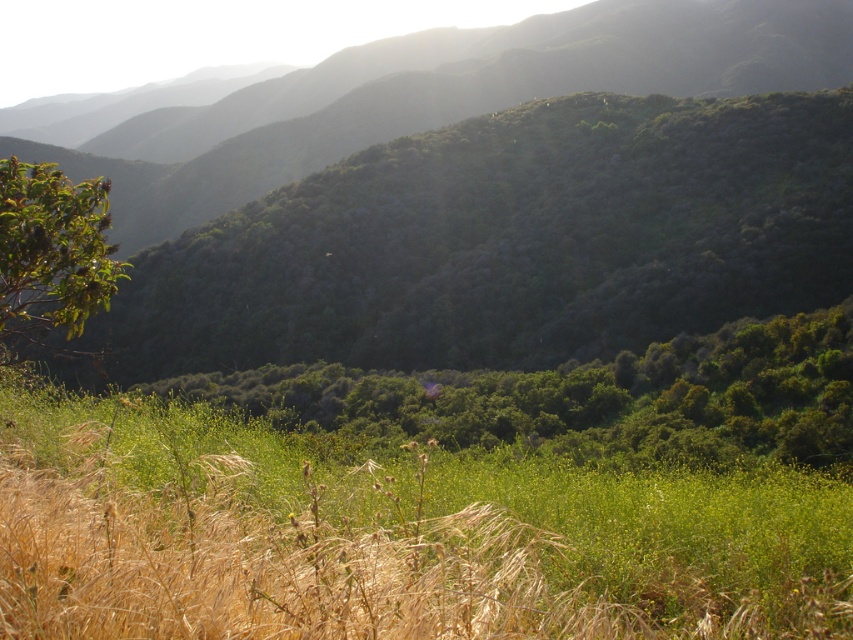
Between green grassy field at lower center and green leafy trees at center, which one has less height?

With less height is green grassy field at lower center.

Who is lower down, green grassy field at lower center or green leafy trees at center?

green leafy trees at center is below.

Measure the distance between point (x=558, y=483) and camera.

A distance of 8.70 meters exists between point (x=558, y=483) and camera.

Find the location of a particular element. Image resolution: width=853 pixels, height=640 pixels. green grassy field at lower center is located at coordinates (387, 536).

Based on the photo, is green leafy trees at center positioned at the back of green leafy tree at left?

That is True.

Is green leafy trees at center thinner than green leafy tree at left?

In fact, green leafy trees at center might be wider than green leafy tree at left.

At what (x,y) coordinates should I click in order to perform the action: click on green leafy trees at center. Please return your answer as a coordinate pair (x, y). Looking at the image, I should click on (590, 397).

The height and width of the screenshot is (640, 853). I want to click on green leafy trees at center, so click(590, 397).

Which is below, green grassy field at lower center or green leafy tree at left?

green leafy tree at left

Between green grassy field at lower center and green leafy tree at left, which one is positioned higher?

Positioned higher is green grassy field at lower center.

I want to click on green grassy field at lower center, so (387, 536).

In order to click on green grassy field at lower center in this screenshot , I will do `click(387, 536)`.